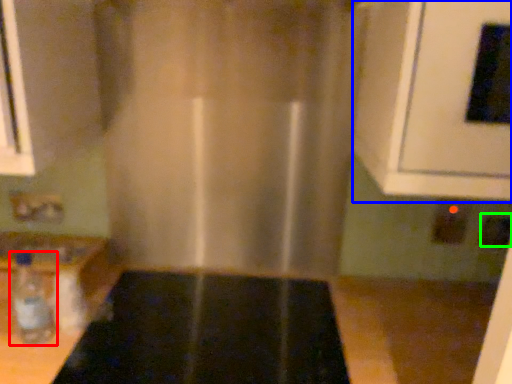
Question: Which object is the closest to the bottle (highlighted by a red box)? Choose among these: oven (highlighted by a blue box) or electric outlet (highlighted by a green box).

Choices:
 (A) oven
 (B) electric outlet

Answer: (A)